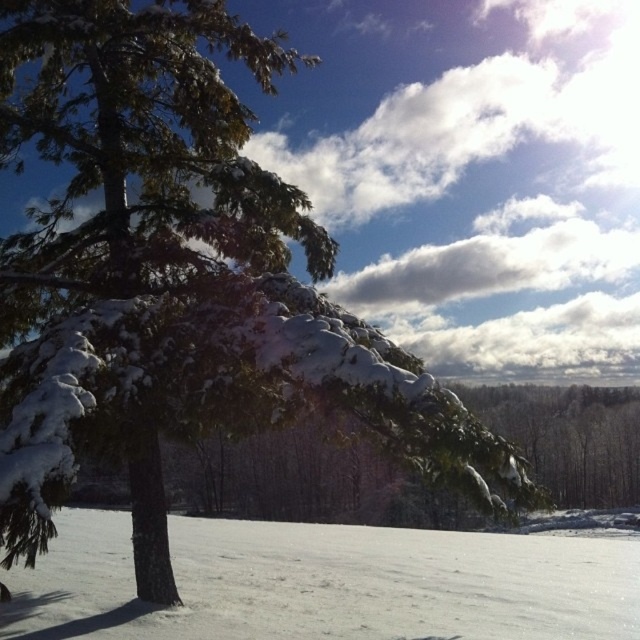
Is white snow at lower left shorter than snow-covered evergreen tree at center?

Yes, white snow at lower left is shorter than snow-covered evergreen tree at center.

Where is `white snow at lower left`? This screenshot has width=640, height=640. white snow at lower left is located at coordinates (326, 582).

Locate an element on the screen. The image size is (640, 640). white snow at lower left is located at coordinates (326, 582).